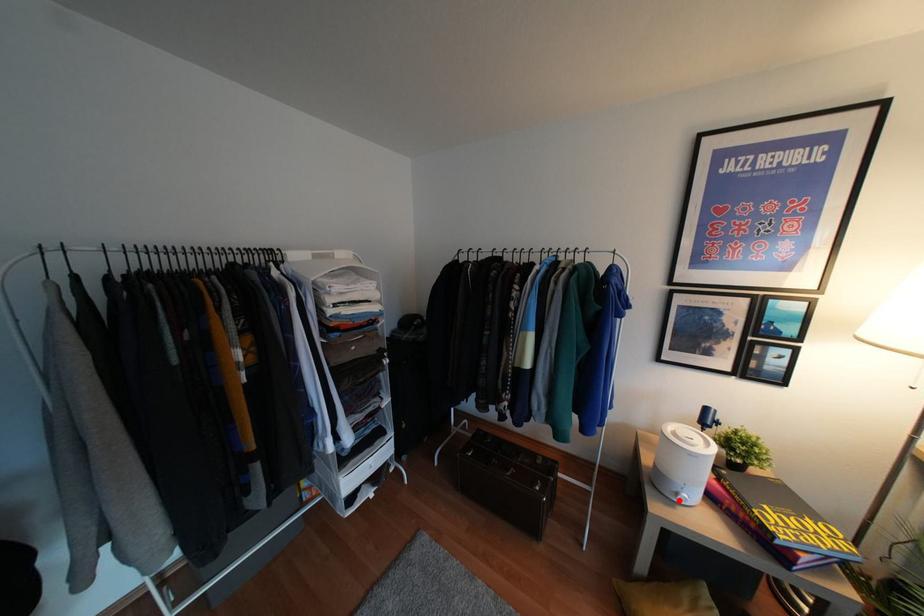
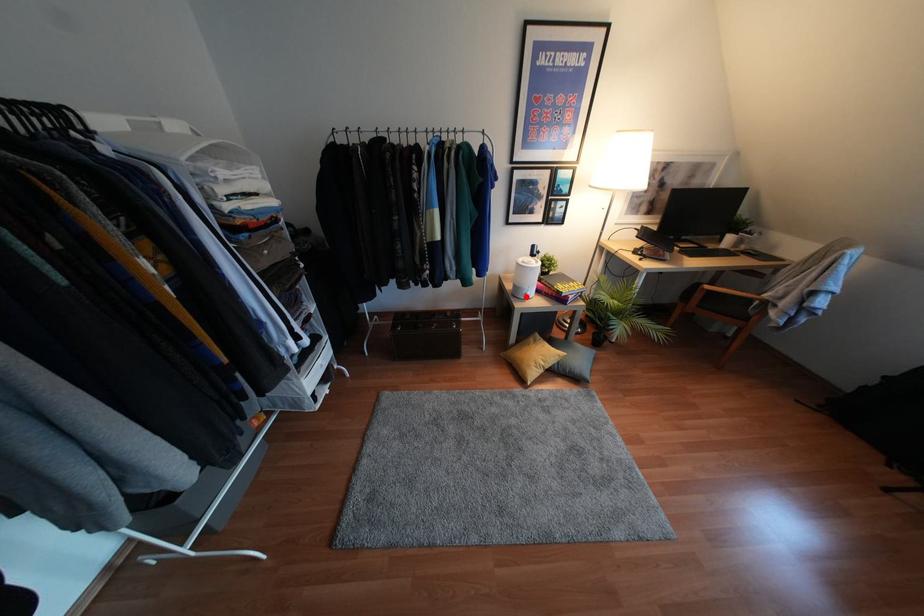
I am providing you with two images of the same scene from different viewpoints. A red point is marked on the first image and another point is marked on the second image. Is the marked point in image1 the same physical position as the marked point in image2?

Yes